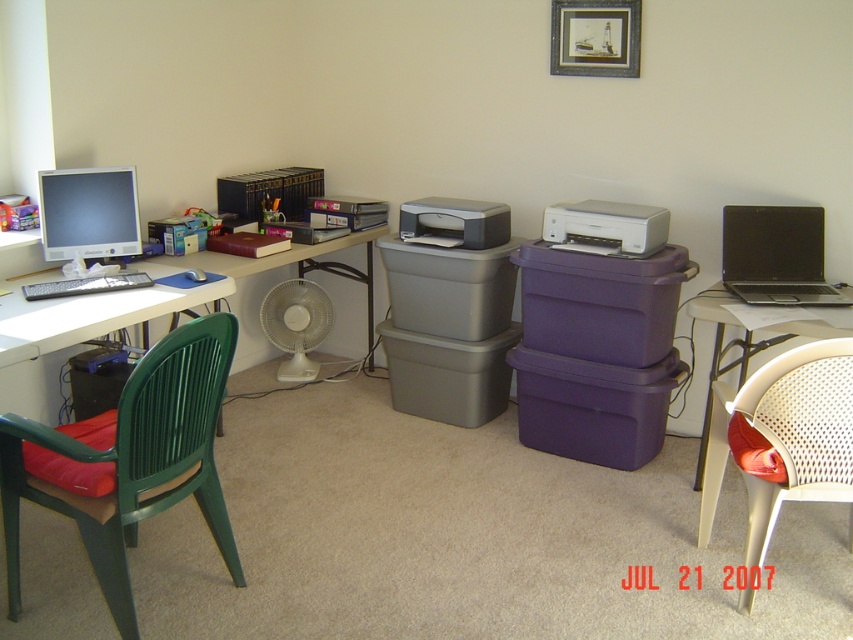
Question: Can you confirm if black glossy laptop at right is wider than matte black monitor at left?

Choices:
 (A) yes
 (B) no

Answer: (A)

Question: Does white plastic printer at center right come in front of matte gray printer at center?

Choices:
 (A) yes
 (B) no

Answer: (A)

Question: Does white mesh swivel chair at right have a larger size compared to white plastic computer desk at left?

Choices:
 (A) no
 (B) yes

Answer: (A)

Question: Which object is the farthest from the white mesh swivel chair at right?

Choices:
 (A) black glossy laptop at right
 (B) matte black monitor at left
 (C) white plastic fan at center

Answer: (B)

Question: Which of these objects is positioned closest to the white mesh swivel chair at right?

Choices:
 (A) white plastic fan at center
 (B) white plastic computer desk at left

Answer: (B)

Question: Which of these objects is positioned farthest from the white plastic printer at center right?

Choices:
 (A) black glossy laptop at right
 (B) white mesh swivel chair at right
 (C) white plastic fan at center

Answer: (C)